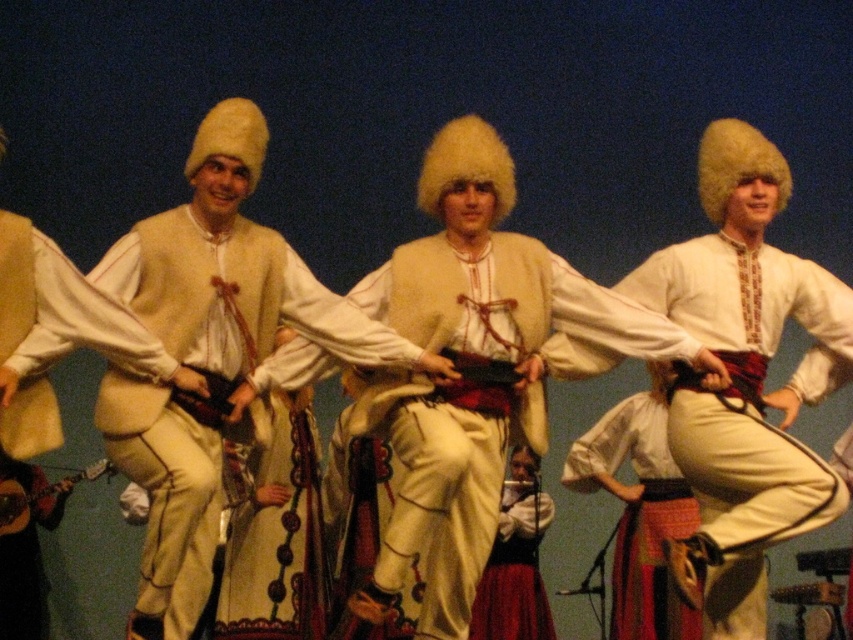
Question: Is white cotton skirt at center bigger than red velvet skirt at center?

Choices:
 (A) no
 (B) yes

Answer: (B)

Question: Which point is closer to the camera?

Choices:
 (A) white woolen hat at center
 (B) white cotton skirt at center
 (C) white woolen vest at center

Answer: (C)

Question: Is white fur hat at center closer to the viewer compared to red velvet skirt at center?

Choices:
 (A) yes
 (B) no

Answer: (A)

Question: Which point appears farthest from the camera in this image?

Choices:
 (A) (x=462, y=419)
 (B) (x=798, y=477)
 (C) (x=537, y=515)

Answer: (C)

Question: Which of the following is the closest to the observer?

Choices:
 (A) (640, 266)
 (B) (537, 570)

Answer: (B)

Question: Is the position of white woolen vest at center more distant than that of white cotton skirt at center?

Choices:
 (A) no
 (B) yes

Answer: (A)